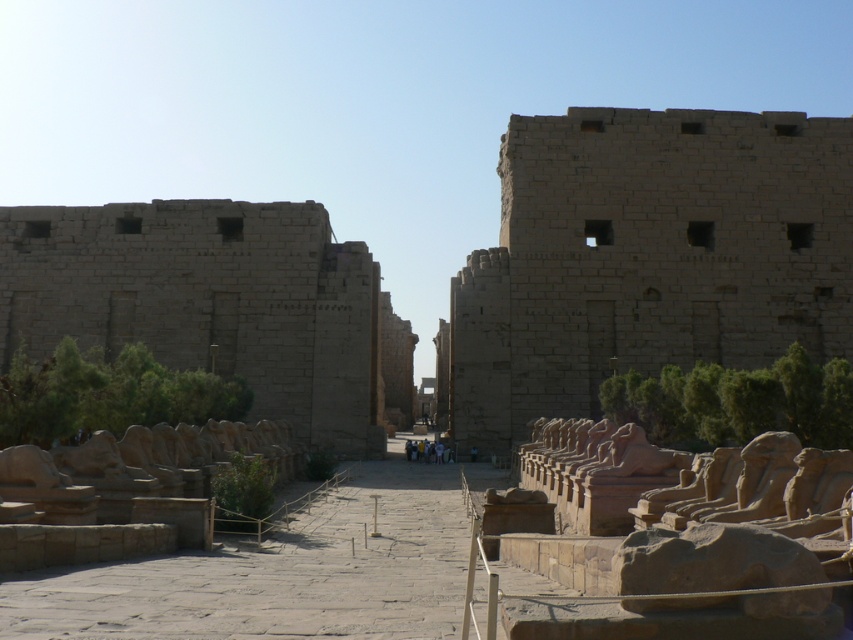
Question: Which point appears closest to the camera in this image?

Choices:
 (A) (306, 381)
 (B) (705, 220)

Answer: (A)

Question: Does brown stone wall at center appear on the left side of beige stone ruins at left?

Choices:
 (A) no
 (B) yes

Answer: (A)

Question: In this image, where is brown stone wall at center located relative to beige stone ruins at left?

Choices:
 (A) left
 (B) right

Answer: (B)

Question: Which object appears closest to the camera in this image?

Choices:
 (A) beige stone ruins at left
 (B) brown stone wall at center

Answer: (B)

Question: Does brown stone wall at center appear under beige stone ruins at left?

Choices:
 (A) no
 (B) yes

Answer: (A)

Question: Among these objects, which one is farthest from the camera?

Choices:
 (A) brown stone wall at center
 (B) beige stone ruins at left

Answer: (B)